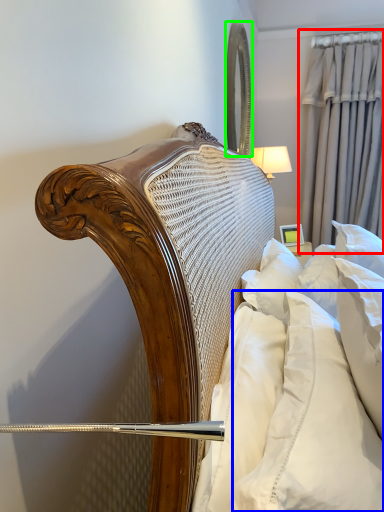
Question: Estimate the real-world distances between objects in this image. Which object is farther from curtain (highlighted by a red box), pillow (highlighted by a blue box) or mirror (highlighted by a green box)?

Choices:
 (A) pillow
 (B) mirror

Answer: (A)